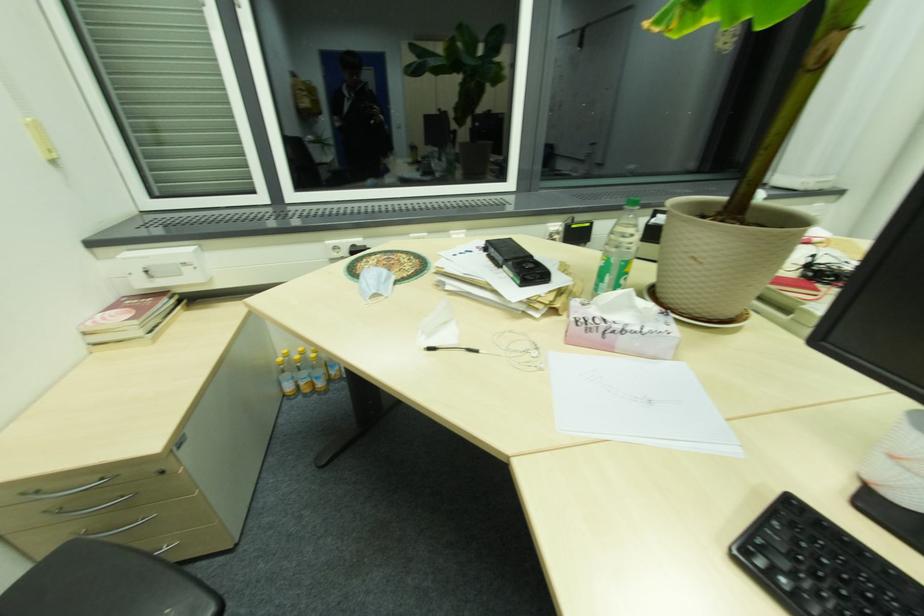
Identify the location of black phone handset. (516, 262).